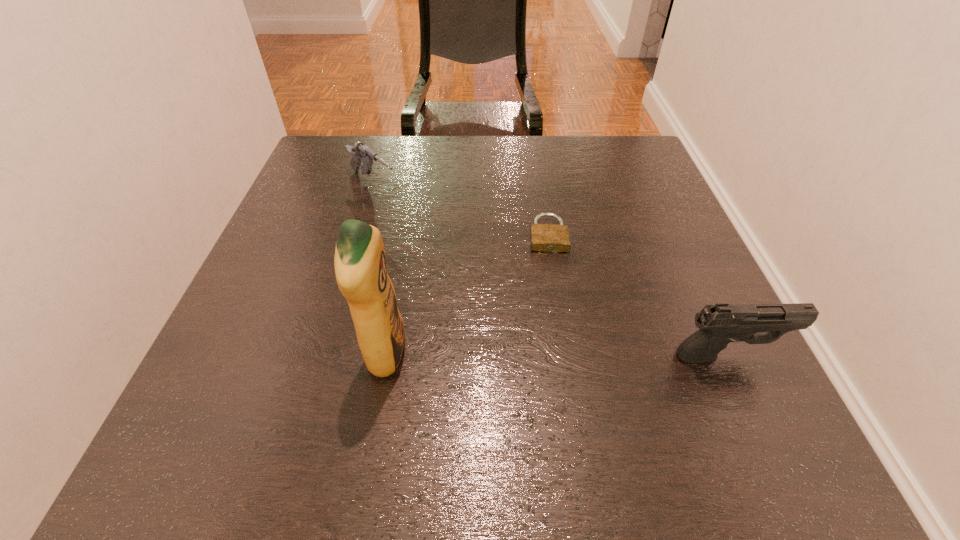
This screenshot has width=960, height=540. I want to click on free space on the desktop that is between the tallest object and the pistol and is positioned on the keyhole side of the second farthest object, so click(x=558, y=355).

Identify the location of vacant space on the desktop that is between the detergent and the second tallest object and is positioned at the barrel of the leftmost object. (587, 355).